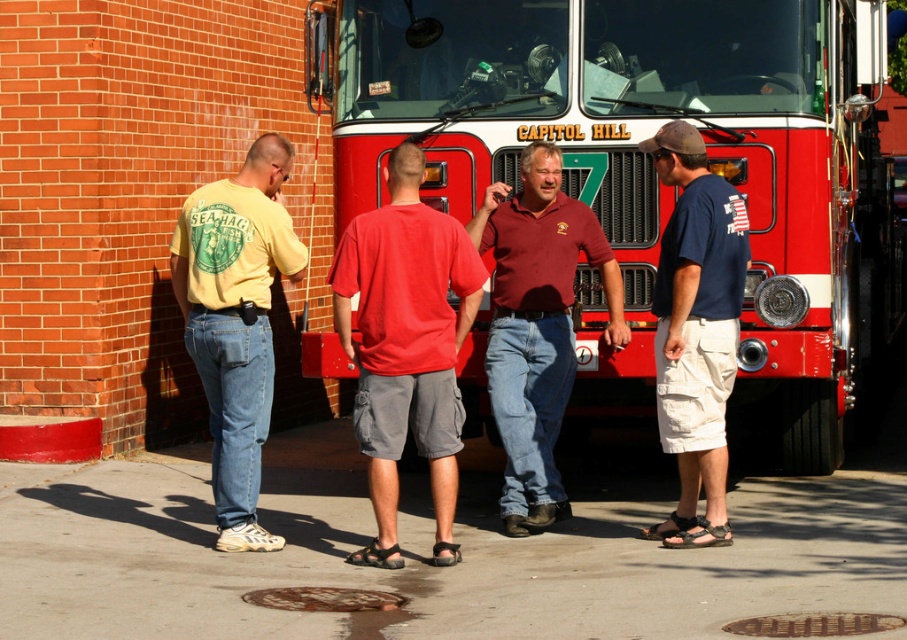
Is red matte fire truck at center below matte yellow t-shirt at left?

No.

Between red matte fire truck at center and matte yellow t-shirt at left, which one is positioned higher?

red matte fire truck at center is above.

Where is `red matte fire truck at center`? Image resolution: width=907 pixels, height=640 pixels. red matte fire truck at center is located at coordinates (652, 170).

Who is more forward, [265,244] or [586,220]?

Point [265,244] is in front.

Does matte yellow t-shirt at left appear on the right side of maroon cotton shirt at center?

Incorrect, matte yellow t-shirt at left is not on the right side of maroon cotton shirt at center.

Between point (251, 291) and point (539, 390), which one is positioned behind?

The point (539, 390) is more distant.

Where is `matte yellow t-shirt at left`? This screenshot has height=640, width=907. matte yellow t-shirt at left is located at coordinates (236, 321).

Does point (434, 29) come farther from viewer compared to point (428, 246)?

Yes, point (434, 29) is farther from viewer.

Is red matte fire truck at center above red cotton t-shirt at center?

Yes, red matte fire truck at center is above red cotton t-shirt at center.

Locate an element on the screen. Image resolution: width=907 pixels, height=640 pixels. red matte fire truck at center is located at coordinates coord(652,170).